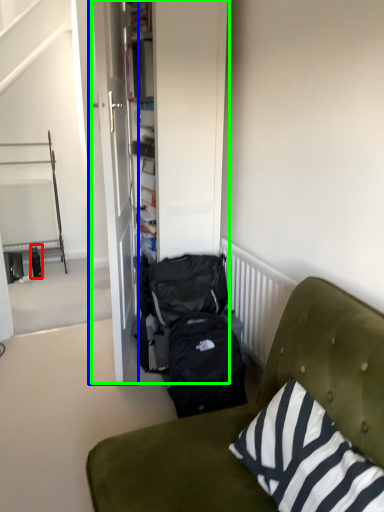
Question: Which object is the closest to the bottle (highlighted by a red box)? Choose among these: door (highlighted by a blue box) or armoire (highlighted by a green box).

Choices:
 (A) door
 (B) armoire

Answer: (A)